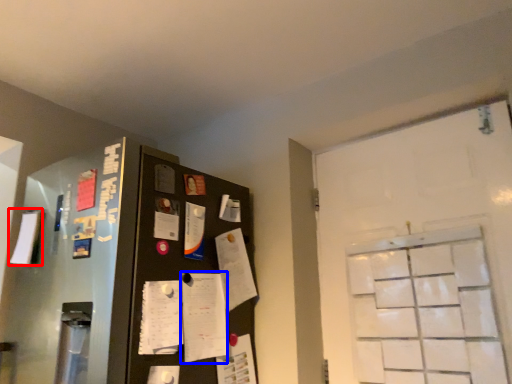
Question: Among these objects, which one is nearest to the camera, paper (highlighted by a red box) or notepad (highlighted by a blue box)?

Choices:
 (A) paper
 (B) notepad

Answer: (B)